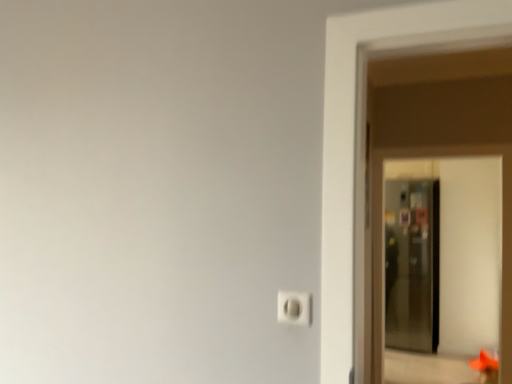
Question: Relative to transparent glass screen door at right, is white plastic light switch at lower center in front or behind?

Choices:
 (A) behind
 (B) front

Answer: (B)

Question: Is white plastic light switch at lower center to the left or to the right of transparent glass screen door at right in the image?

Choices:
 (A) right
 (B) left

Answer: (B)

Question: From the image's perspective, is white plastic light switch at lower center above or below transparent glass screen door at right?

Choices:
 (A) above
 (B) below

Answer: (A)

Question: From a real-world perspective, relative to white plastic light switch at lower center, is transparent glass screen door at right vertically above or below?

Choices:
 (A) above
 (B) below

Answer: (B)

Question: From their relative heights in the image, would you say transparent glass screen door at right is taller or shorter than white plastic light switch at lower center?

Choices:
 (A) short
 (B) tall

Answer: (B)

Question: Would you say transparent glass screen door at right is inside or outside white plastic light switch at lower center?

Choices:
 (A) inside
 (B) outside

Answer: (B)

Question: Looking at their shapes, would you say transparent glass screen door at right is wider or thinner than white plastic light switch at lower center?

Choices:
 (A) wide
 (B) thin

Answer: (A)